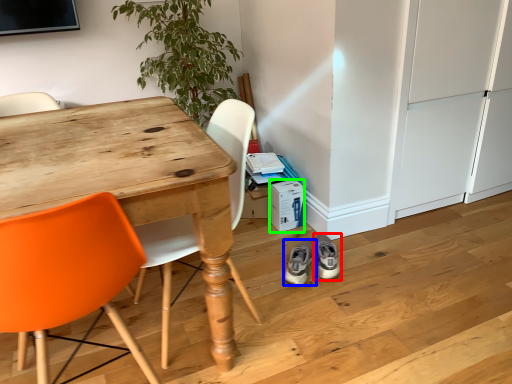
Question: Based on their relative distances, which object is farther from footwear (highlighted by a red box)? Choose from footwear (highlighted by a blue box) and box (highlighted by a green box).

Choices:
 (A) footwear
 (B) box

Answer: (B)